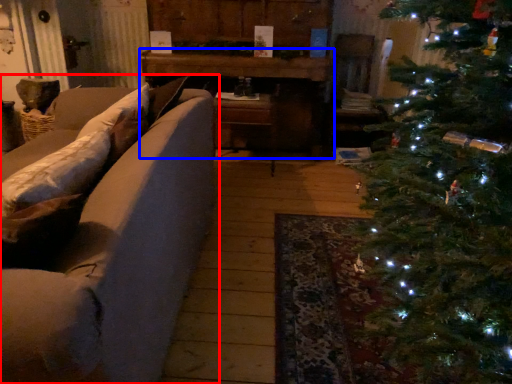
Question: Which point is closer to the camera, studio couch (highlighted by a red box) or table (highlighted by a blue box)?

Choices:
 (A) studio couch
 (B) table

Answer: (A)